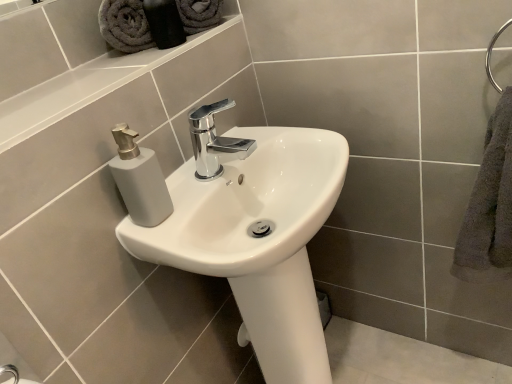
Question: Would you say gray cotton towel at upper left, the second bath towel when ordered from bottom to top, contains gray fabric towels at upper left?

Choices:
 (A) no
 (B) yes

Answer: (A)

Question: Is gray cotton towel at upper left, positioned as the second bath towel in right-to-left order, positioned beyond the bounds of gray fabric towels at upper left?

Choices:
 (A) yes
 (B) no

Answer: (A)

Question: Can you confirm if gray cotton towel at upper left, acting as the first bath towel starting from the top, is positioned to the right of gray fabric towels at upper left?

Choices:
 (A) no
 (B) yes

Answer: (A)

Question: Is gray cotton towel at upper left, positioned as the 1th bath towel in left-to-right order, facing towards gray fabric towels at upper left?

Choices:
 (A) yes
 (B) no

Answer: (A)

Question: From the image's perspective, is gray cotton towel at upper left, positioned as the second bath towel in right-to-left order, beneath gray fabric towels at upper left?

Choices:
 (A) yes
 (B) no

Answer: (A)

Question: Looking at their shapes, would you say white glossy sink at center is wider or thinner than gray fabric towels at upper left?

Choices:
 (A) wide
 (B) thin

Answer: (A)

Question: Is white glossy sink at center taller or shorter than gray fabric towels at upper left?

Choices:
 (A) short
 (B) tall

Answer: (B)

Question: Considering the positions of point (279, 157) and point (175, 43), is point (279, 157) closer or farther from the camera than point (175, 43)?

Choices:
 (A) farther
 (B) closer

Answer: (A)

Question: Considering their positions, is white glossy sink at center located in front of or behind gray fabric towels at upper left?

Choices:
 (A) behind
 (B) front

Answer: (B)

Question: Is point (120, 82) positioned closer to the camera than point (496, 233)?

Choices:
 (A) farther
 (B) closer

Answer: (B)

Question: Relative to gray fluffy towel at right, which ranks as the first bath towel in bottom-to-top order, is white glossy ledge at upper left in front or behind?

Choices:
 (A) front
 (B) behind

Answer: (A)

Question: Looking at their shapes, would you say white glossy ledge at upper left is wider or thinner than gray fluffy towel at right, which appears as the first bath towel when viewed from the right?

Choices:
 (A) thin
 (B) wide

Answer: (B)

Question: Is white glossy ledge at upper left bigger or smaller than gray fluffy towel at right, which is counted as the second bath towel, starting from the left?

Choices:
 (A) big
 (B) small

Answer: (B)

Question: Looking at their shapes, would you say gray fluffy towel at right, which appears as the first bath towel when viewed from the right, is wider or thinner than gray cotton towel at upper left, the second bath towel when ordered from bottom to top?

Choices:
 (A) wide
 (B) thin

Answer: (A)

Question: In terms of height, does gray fluffy towel at right, which ranks as the first bath towel in bottom-to-top order, look taller or shorter compared to gray cotton towel at upper left, positioned as the second bath towel in right-to-left order?

Choices:
 (A) tall
 (B) short

Answer: (A)